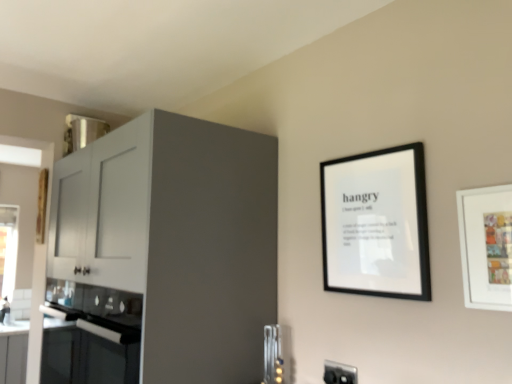
Question: Is white matte picture frame at right, the 1th picture frame viewed from the front, thinner than black matte picture frame at upper right, which is counted as the 2th picture frame, starting from the right?

Choices:
 (A) no
 (B) yes

Answer: (B)

Question: From the image's perspective, is white matte picture frame at right, the 1th picture frame viewed from the front, over black matte picture frame at upper right, acting as the 1th picture frame starting from the left?

Choices:
 (A) yes
 (B) no

Answer: (B)

Question: Is white matte picture frame at right, which is the 2th picture frame from back to front, located outside black matte picture frame at upper right, acting as the 1th picture frame starting from the left?

Choices:
 (A) no
 (B) yes

Answer: (B)

Question: Is white matte picture frame at right, the 1th picture frame viewed from the front, to the left of black matte picture frame at upper right, marked as the first picture frame in a back-to-front arrangement, from the viewer's perspective?

Choices:
 (A) no
 (B) yes

Answer: (A)

Question: Is the surface of white matte picture frame at right, positioned as the 2th picture frame in left-to-right order, in direct contact with black matte picture frame at upper right, marked as the first picture frame in a back-to-front arrangement?

Choices:
 (A) yes
 (B) no

Answer: (B)

Question: Relative to black glass oven at lower left, is matte white cabinet at left in front or behind?

Choices:
 (A) behind
 (B) front

Answer: (B)

Question: From the image's perspective, is matte white cabinet at left above or below black glass oven at lower left?

Choices:
 (A) below
 (B) above

Answer: (B)

Question: Considering the positions of point (96, 243) and point (138, 375), is point (96, 243) closer or farther from the camera than point (138, 375)?

Choices:
 (A) farther
 (B) closer

Answer: (A)

Question: Based on their positions, is matte white cabinet at left located to the left or right of black glass oven at lower left?

Choices:
 (A) left
 (B) right

Answer: (B)

Question: From a real-world perspective, is black matte picture frame at upper right, acting as the 1th picture frame starting from the left, above or below metallic silver utensils at lower center?

Choices:
 (A) above
 (B) below

Answer: (A)

Question: In terms of height, does black matte picture frame at upper right, which is counted as the 2th picture frame, starting from the right, look taller or shorter compared to metallic silver utensils at lower center?

Choices:
 (A) tall
 (B) short

Answer: (A)

Question: Is black matte picture frame at upper right, the second picture frame viewed from the front, spatially inside metallic silver utensils at lower center, or outside of it?

Choices:
 (A) outside
 (B) inside

Answer: (A)

Question: Considering the positions of black matte picture frame at upper right, which is counted as the 2th picture frame, starting from the right, and metallic silver utensils at lower center in the image, is black matte picture frame at upper right, which is counted as the 2th picture frame, starting from the right, wider or thinner than metallic silver utensils at lower center?

Choices:
 (A) wide
 (B) thin

Answer: (B)

Question: From a real-world perspective, is black plastic electric outlet at lower right above or below white matte picture frame at right, which is the 2th picture frame from back to front?

Choices:
 (A) below
 (B) above

Answer: (A)

Question: Is point (342, 369) closer or farther from the camera than point (490, 213)?

Choices:
 (A) closer
 (B) farther

Answer: (B)